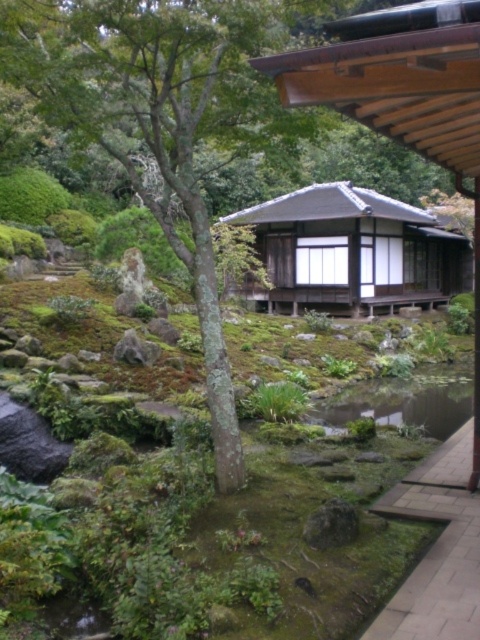
You are standing at the entrance of the garden and want to reach the wooden structure with a sloped roof on the right. Which direction should you walk to follow the paved stone path at lower right?

The paved stone path at lower right is located at point (436, 548), so you should walk towards the lower right direction to follow it.

You are standing at the center of the Japanese garden scene. There is a paved stone path at lower right marked by point (436, 548). Can you walk directly towards the wooden structure with a sloped roof on the right without crossing the pond?

The paved stone path at lower right marked by point (436, 548) leads towards the wooden structure with a sloped roof on the right, so yes, you can walk directly towards it without crossing the pond.

You are a visitor walking towards the wooden structure in the Japanese garden. You see the paved stone path at lower right and the green mossy stream at center. Which one is closer to your current position?

The paved stone path at lower right is closer to your current position because it is in front of the green mossy stream at center.